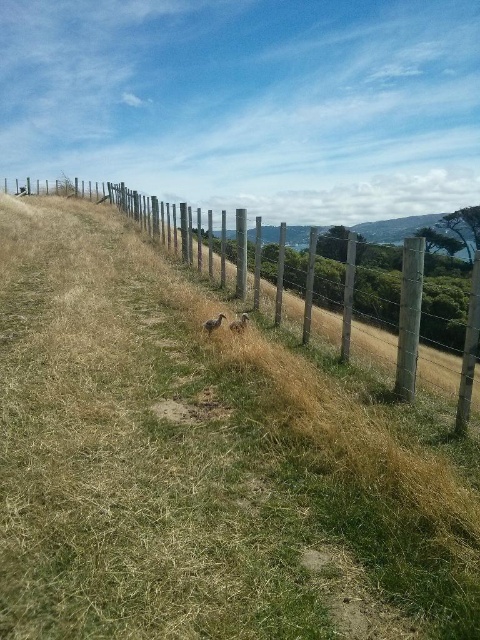
Question: Considering the relative positions of brown fuzzy bird at center and brown fuzzy rabbit at center in the image provided, where is brown fuzzy bird at center located with respect to brown fuzzy rabbit at center?

Choices:
 (A) right
 (B) left

Answer: (A)

Question: Does wooden post fence at center appear on the right side of brown fuzzy bird at center?

Choices:
 (A) no
 (B) yes

Answer: (B)

Question: Does wooden post fence at center have a larger size compared to brown fuzzy rabbit at center?

Choices:
 (A) no
 (B) yes

Answer: (B)

Question: Which object appears closest to the camera in this image?

Choices:
 (A) wooden post fence at center
 (B) brown fuzzy bird at center

Answer: (A)

Question: Which object is closer to the camera taking this photo?

Choices:
 (A) wooden post fence at center
 (B) brown fuzzy bird at center
 (C) brown fuzzy rabbit at center

Answer: (A)

Question: Which object appears closest to the camera in this image?

Choices:
 (A) wooden post fence at center
 (B) brown fuzzy bird at center
 (C) brown fuzzy rabbit at center

Answer: (A)